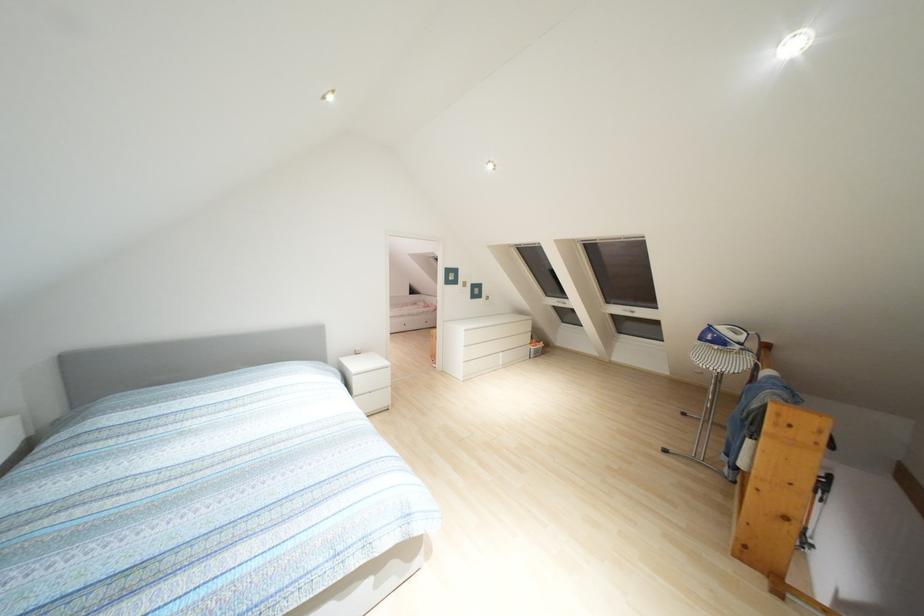
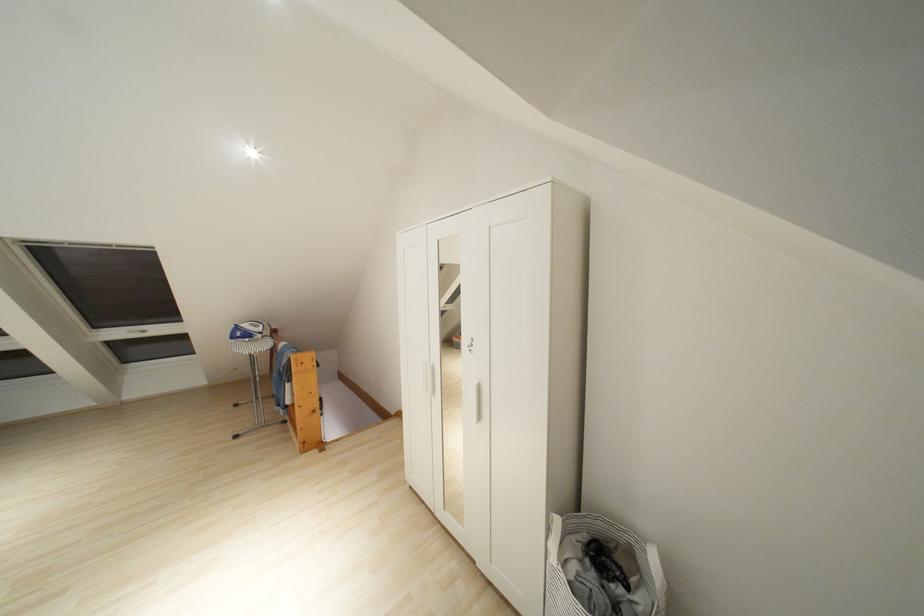
Question: Based on the continuous images, in which direction is the camera rotating? Reply with the corresponding letter.

Choices:
 (A) Left
 (B) Right
 (C) Up
 (D) Down

Answer: (B)